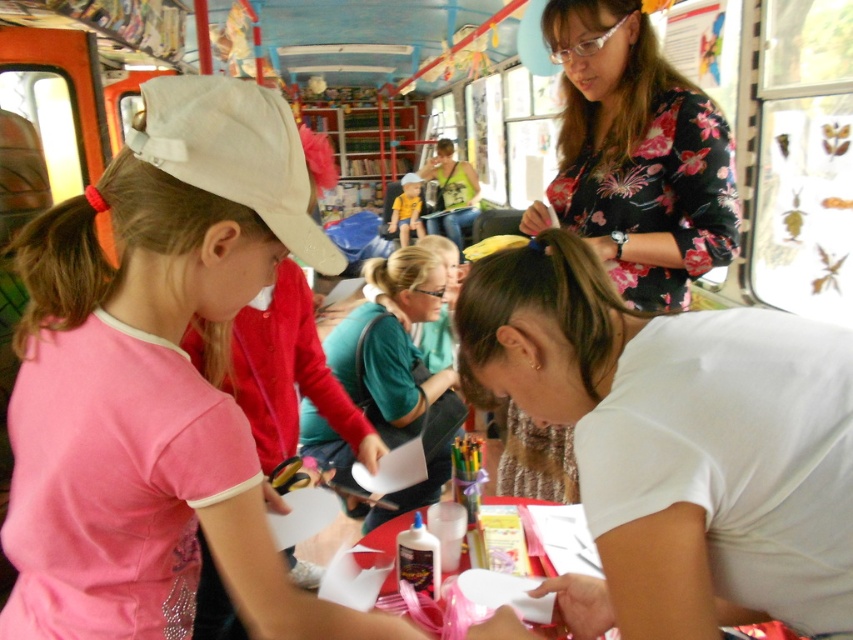
Question: Is pink fabric shirt at center closer to camera compared to matte yellow shirt at center?

Choices:
 (A) no
 (B) yes

Answer: (B)

Question: Which object is the farthest from the green matte shirt at center?

Choices:
 (A) floral print blouse at upper center
 (B) pink fabric shirt at center
 (C) white matte shirt at lower right
 (D) yellow shirt at center

Answer: (D)

Question: From the image, what is the correct spatial relationship of green matte shirt at center in relation to yellow shirt at center?

Choices:
 (A) above
 (B) below

Answer: (B)

Question: Estimate the real-world distances between objects in this image. Which object is closer to the white matte shirt at lower right?

Choices:
 (A) matte yellow shirt at center
 (B) yellow shirt at center
 (C) pink fabric shirt at center
 (D) green matte shirt at center

Answer: (C)

Question: Estimate the real-world distances between objects in this image. Which object is closer to the green matte shirt at center?

Choices:
 (A) yellow shirt at center
 (B) matte yellow shirt at center
 (C) pink fabric shirt at center

Answer: (C)

Question: Can you confirm if pink fabric shirt at center is positioned to the left of white matte shirt at lower right?

Choices:
 (A) yes
 (B) no

Answer: (A)